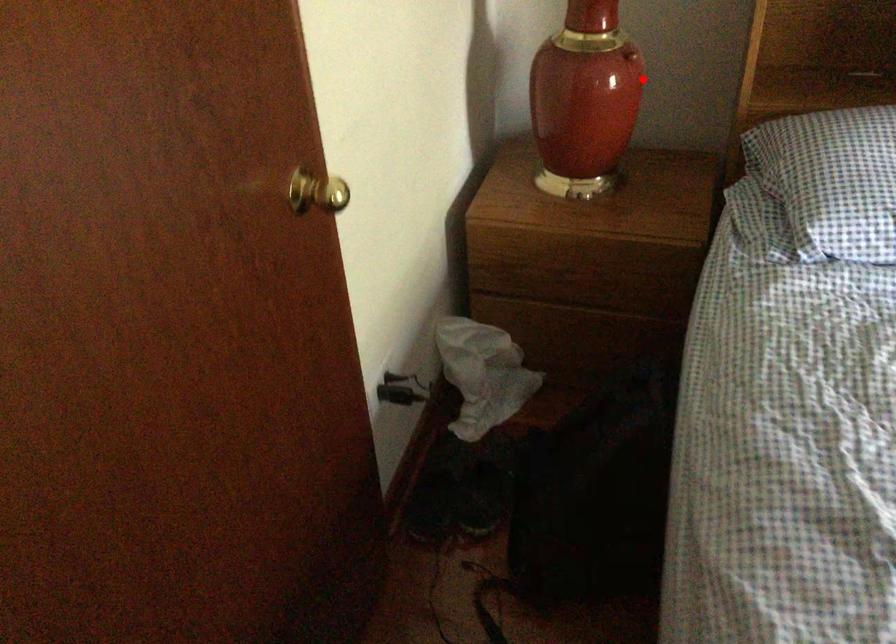
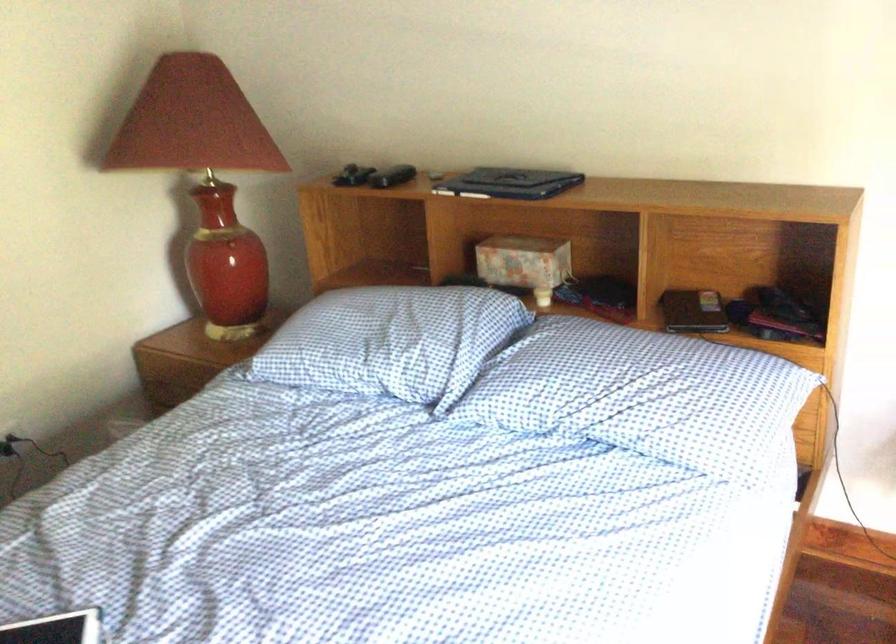
Question: I am providing you with two images of the same scene from different viewpoints. Image1 has a red point marked. In image2, the corresponding 3D location appears at what relative position? Reply with the corresponding letter.

Choices:
 (A) Closer
 (B) Farther

Answer: (B)